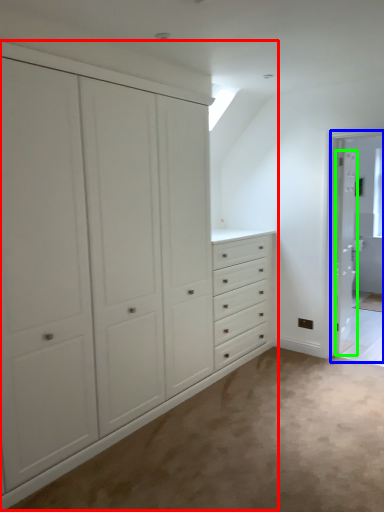
Question: Considering the real-world distances, which object is closest to cupboard (highlighted by a red box)? screen door (highlighted by a blue box) or door (highlighted by a green box).

Choices:
 (A) screen door
 (B) door

Answer: (A)